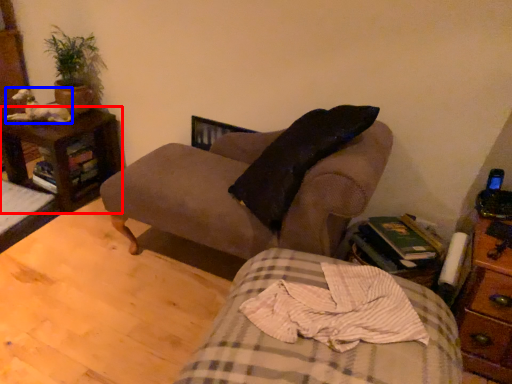
Question: Which object appears farthest to the camera in this image, nightstand (highlighted by a red box) or animal (highlighted by a blue box)?

Choices:
 (A) nightstand
 (B) animal

Answer: (B)